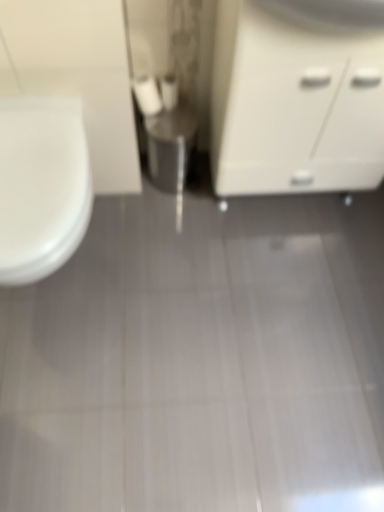
Question: Can you confirm if white matte cabinet at right is thinner than white matte toilet paper at center, which is the second toilet paper in right-to-left order?

Choices:
 (A) no
 (B) yes

Answer: (A)

Question: Considering the relative positions of white matte cabinet at right and white matte toilet paper at center, which is the second toilet paper in right-to-left order, in the image provided, is white matte cabinet at right in front of white matte toilet paper at center, which is the second toilet paper in right-to-left order,?

Choices:
 (A) no
 (B) yes

Answer: (B)

Question: From the image's perspective, is white matte cabinet at right under white matte toilet paper at center, which is the second toilet paper in right-to-left order?

Choices:
 (A) yes
 (B) no

Answer: (A)

Question: Does white matte cabinet at right have a lesser height compared to white matte toilet paper at center, which is the second toilet paper in right-to-left order?

Choices:
 (A) yes
 (B) no

Answer: (B)

Question: From a real-world perspective, is white matte cabinet at right on top of white matte toilet paper at center, the first toilet paper viewed from the left?

Choices:
 (A) yes
 (B) no

Answer: (A)

Question: Considering the relative sizes of white matte cabinet at right and white matte toilet paper at center, the first toilet paper viewed from the left, in the image provided, is white matte cabinet at right wider than white matte toilet paper at center, the first toilet paper viewed from the left,?

Choices:
 (A) no
 (B) yes

Answer: (B)

Question: Is white matte cabinet at right not inside white glossy toilet at left?

Choices:
 (A) no
 (B) yes

Answer: (B)

Question: Considering the relative sizes of white matte cabinet at right and white glossy toilet at left in the image provided, is white matte cabinet at right taller than white glossy toilet at left?

Choices:
 (A) no
 (B) yes

Answer: (B)

Question: From the image's perspective, is white matte cabinet at right beneath white glossy toilet at left?

Choices:
 (A) no
 (B) yes

Answer: (A)

Question: Is white matte cabinet at right positioned in front of white glossy toilet at left?

Choices:
 (A) yes
 (B) no

Answer: (A)

Question: From the image's perspective, does white matte cabinet at right appear higher than white glossy toilet at left?

Choices:
 (A) yes
 (B) no

Answer: (A)

Question: Would you consider white matte cabinet at right to be distant from white glossy toilet at left?

Choices:
 (A) no
 (B) yes

Answer: (A)

Question: From the image's perspective, is white matte toilet paper at center, which is the second toilet paper in right-to-left order, on top of white matte toilet paper at center, placed as the 1th toilet paper when sorted from right to left?

Choices:
 (A) yes
 (B) no

Answer: (B)